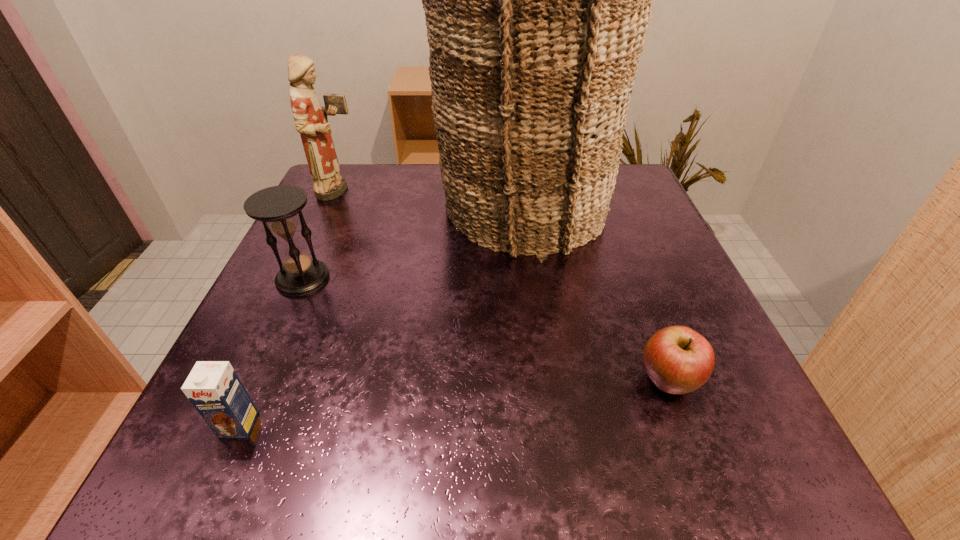
Find the location of `unoccupied position between the chocolate milk and the third shortest object`. unoccupied position between the chocolate milk and the third shortest object is located at coordinates (271, 352).

Find the location of a particular element. This screenshot has width=960, height=540. vacant area between the second nearest object and the tallest object is located at coordinates point(594,294).

This screenshot has width=960, height=540. Identify the location of vacant space that is in between the nearest object and the hourglass. (271, 352).

Where is `free space between the second tallest object and the chocolate milk`? This screenshot has height=540, width=960. free space between the second tallest object and the chocolate milk is located at coordinates (289, 308).

You are a GUI agent. You are given a task and a screenshot of the screen. Output one action in this format:
    pyautogui.click(x=<x>, y=<y>)
    Task: Click on the free area in between the chocolate milk and the fourth farthest object
    
    Given the screenshot: What is the action you would take?
    click(453, 403)

Where is `unoccupied area between the second tallest object and the basket`? unoccupied area between the second tallest object and the basket is located at coordinates (430, 199).

This screenshot has width=960, height=540. I want to click on free point between the hourglass and the figurine, so click(321, 234).

Find the location of a particular element. Image resolution: width=960 pixels, height=540 pixels. free spot between the fourth shortest object and the tallest object is located at coordinates (430, 199).

Find the location of a particular element. object identified as the fourth closest to the second tallest object is located at coordinates (678, 360).

Locate which object is the second closest to the figurine. Please provide its 2D coordinates. Your answer should be formatted as a tuple, i.e. [(x, y)], where the tuple contains the x and y coordinates of a point satisfying the conditions above.

[(277, 207)]